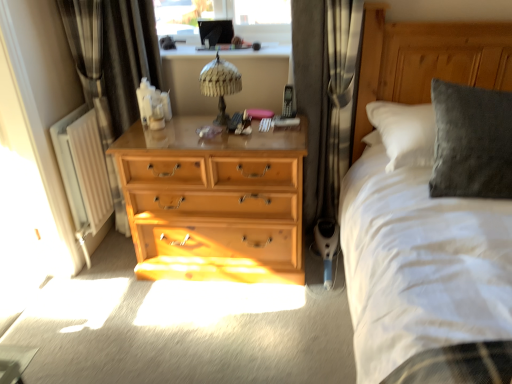
Question: From the image's perspective, does black fabric curtain at left, which is the 2th curtain in right-to-left order, appear higher than dark grey fabric curtain at center, marked as the 2th curtain in a left-to-right arrangement?

Choices:
 (A) yes
 (B) no

Answer: (B)

Question: Can you confirm if black fabric curtain at left, placed as the first curtain when sorted from left to right, is positioned to the left of dark grey fabric curtain at center, placed as the first curtain when sorted from right to left?

Choices:
 (A) no
 (B) yes

Answer: (B)

Question: Is black fabric curtain at left, placed as the first curtain when sorted from left to right, positioned behind dark grey fabric curtain at center, placed as the first curtain when sorted from right to left?

Choices:
 (A) no
 (B) yes

Answer: (B)

Question: Are black fabric curtain at left, placed as the first curtain when sorted from left to right, and dark grey fabric curtain at center, placed as the first curtain when sorted from right to left, located far from each other?

Choices:
 (A) no
 (B) yes

Answer: (A)

Question: Is black fabric curtain at left, placed as the first curtain when sorted from left to right, positioned beyond the bounds of dark grey fabric curtain at center, marked as the 2th curtain in a left-to-right arrangement?

Choices:
 (A) yes
 (B) no

Answer: (A)

Question: Considering their positions, is black fabric curtain at left, which is the 2th curtain in right-to-left order, located in front of or behind dark grey fabric curtain at center, placed as the first curtain when sorted from right to left?

Choices:
 (A) front
 (B) behind

Answer: (B)

Question: From a real-world perspective, relative to dark grey fabric curtain at center, marked as the 2th curtain in a left-to-right arrangement, is black fabric curtain at left, which is the 2th curtain in right-to-left order, vertically above or below?

Choices:
 (A) below
 (B) above

Answer: (B)

Question: Does point [104, 0] appear closer or farther from the camera than point [315, 170]?

Choices:
 (A) farther
 (B) closer

Answer: (B)

Question: Visually, is black fabric curtain at left, placed as the first curtain when sorted from left to right, positioned to the left or to the right of dark grey fabric curtain at center, marked as the 2th curtain in a left-to-right arrangement?

Choices:
 (A) right
 (B) left

Answer: (B)

Question: Is black fabric curtain at left, placed as the first curtain when sorted from left to right, in front of or behind white painted metal radiator at left in the image?

Choices:
 (A) behind
 (B) front

Answer: (B)

Question: Considering the positions of black fabric curtain at left, which is the 2th curtain in right-to-left order, and white painted metal radiator at left in the image, is black fabric curtain at left, which is the 2th curtain in right-to-left order, bigger or smaller than white painted metal radiator at left?

Choices:
 (A) small
 (B) big

Answer: (B)

Question: From a real-world perspective, is black fabric curtain at left, placed as the first curtain when sorted from left to right, positioned above or below white painted metal radiator at left?

Choices:
 (A) below
 (B) above

Answer: (B)

Question: Considering the positions of black fabric curtain at left, placed as the first curtain when sorted from left to right, and white painted metal radiator at left in the image, is black fabric curtain at left, placed as the first curtain when sorted from left to right, taller or shorter than white painted metal radiator at left?

Choices:
 (A) short
 (B) tall

Answer: (B)

Question: Considering the positions of light wood dresser at center and woven fabric table lamp at center in the image, is light wood dresser at center taller or shorter than woven fabric table lamp at center?

Choices:
 (A) short
 (B) tall

Answer: (B)

Question: Choose the correct answer: Is light wood dresser at center inside woven fabric table lamp at center or outside it?

Choices:
 (A) outside
 (B) inside

Answer: (A)